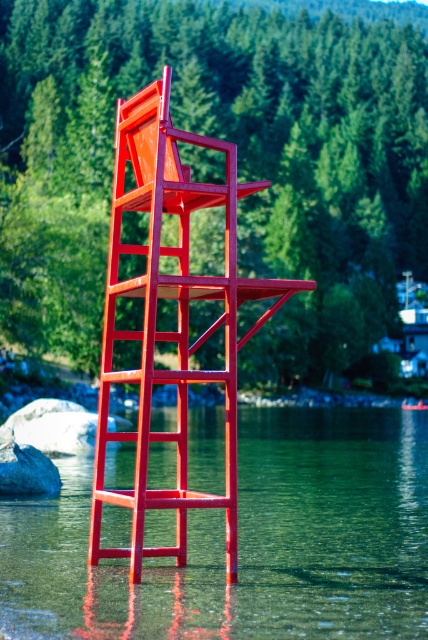
You are a painter who wants to paint the tallest object in the scene. Which object should you choose between the metallic red ladder at center and the gray rock at lower left?

The metallic red ladder at center is taller than the gray rock at lower left, so you should choose the metallic red ladder at center to paint.

You are a photographer trying to capture the metallic red ladder at center and the gray rock at center in the same frame. Based on their positions, which object will appear closer to the camera in your photo?

The metallic red ladder at center appears closer to the camera because it is positioned in front of the gray rock at center.